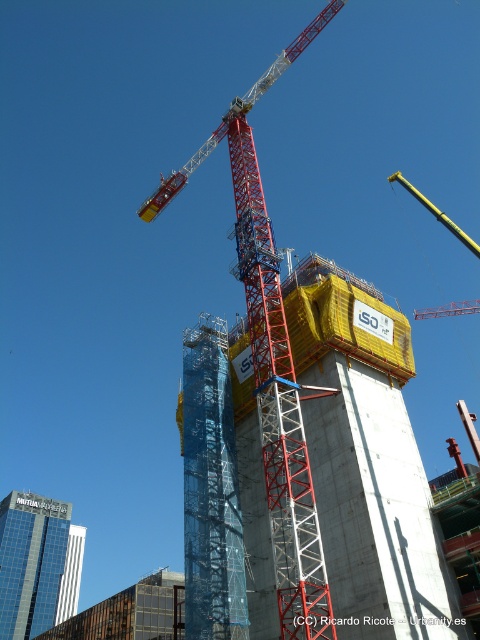
You are an engineer observing the construction site. You need to determine which crane is taller between the red metal crane at center and the yellow metallic crane at upper center. Based on the scene, which one is taller?

The red metal crane at center is taller than the yellow metallic crane at upper center.